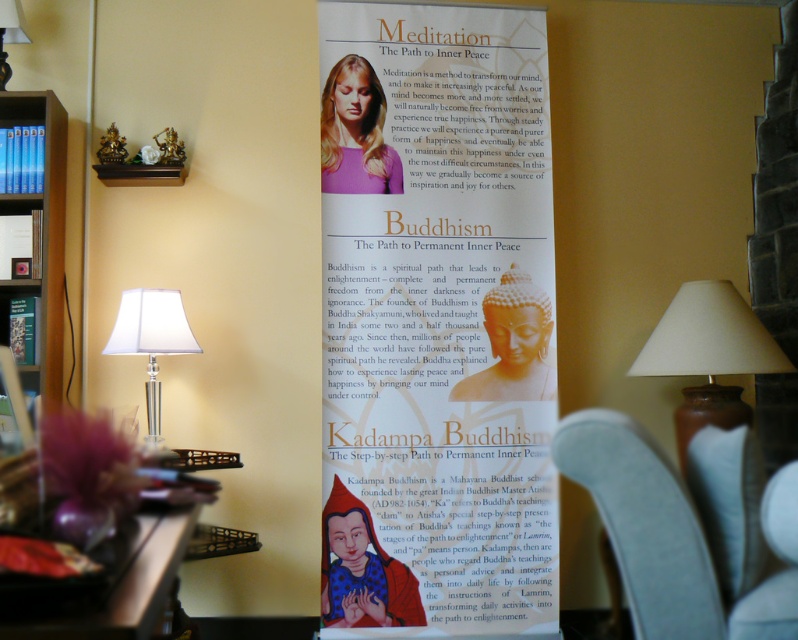
You are organizing a library display and have to place the matte paper poster at center and the blue hardcover books at left. Given that the display area has limited space, which item should you place first to maximize space efficiency?

The matte paper poster at center is bigger than blue hardcover books at left, so you should place the blue hardcover books at left first to accommodate the larger poster afterward.